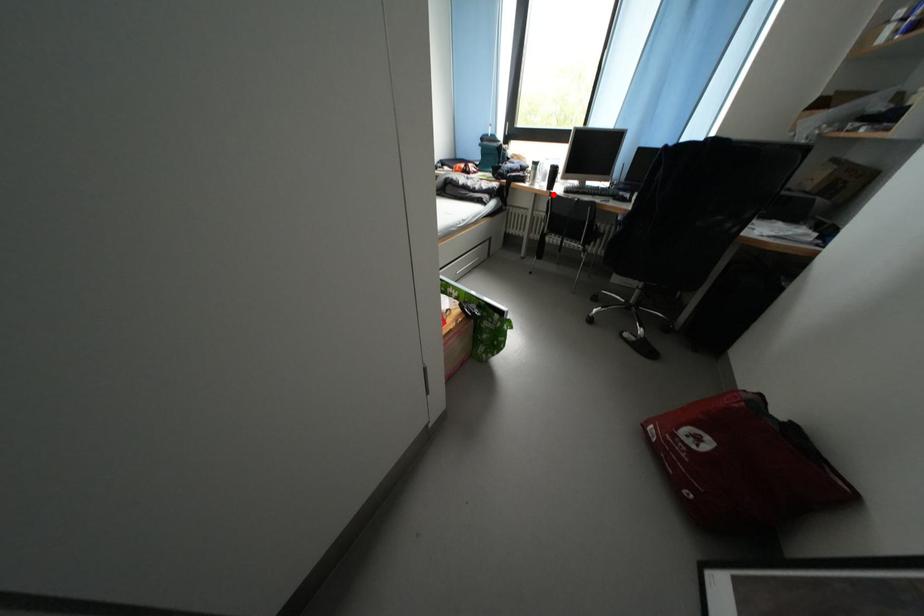
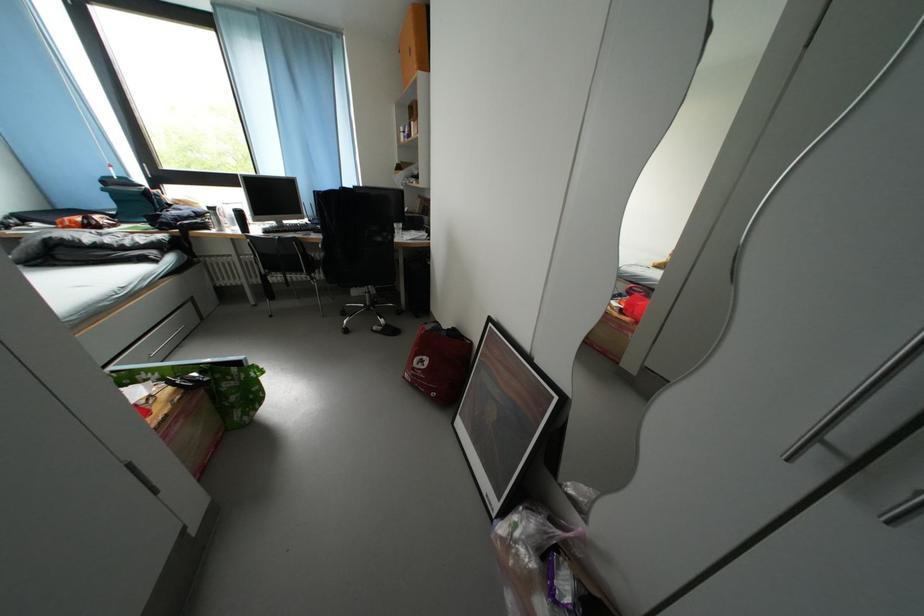
Locate, in the second image, the point that corresponds to the highlighted location in the first image.

(248, 238)